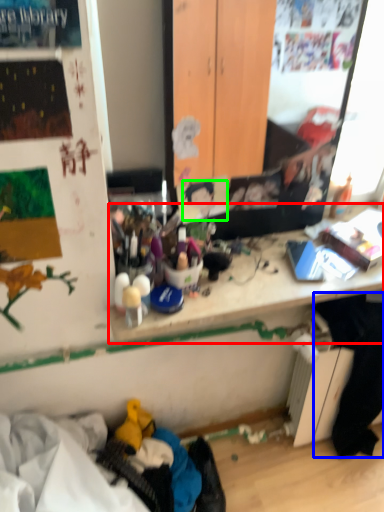
Question: Based on their relative distances, which object is farther from writing desk (highlighted by a red box)? Choose from clothing (highlighted by a blue box) and person (highlighted by a green box).

Choices:
 (A) clothing
 (B) person

Answer: (A)